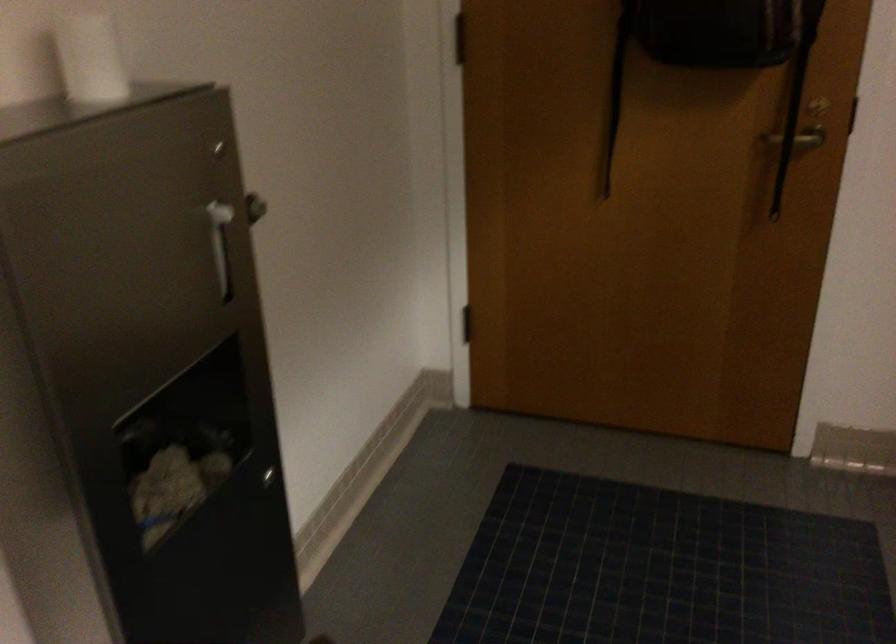
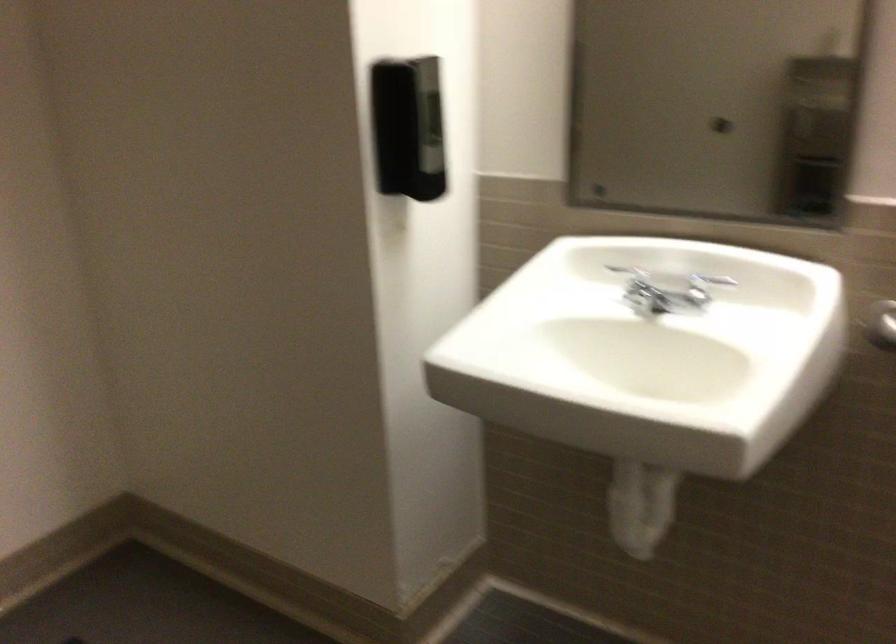
Question: How did the camera likely rotate?

Choices:
 (A) Left
 (B) Right
 (C) Up
 (D) Down

Answer: (B)